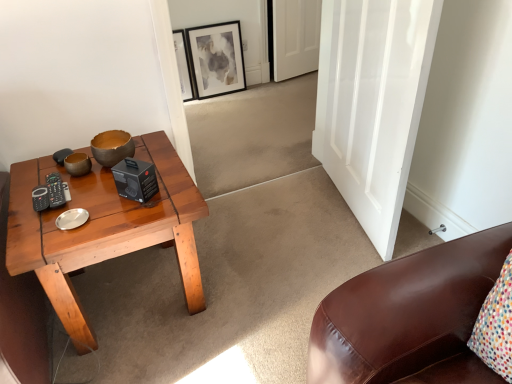
The height and width of the screenshot is (384, 512). Identify the location of vacant area situated below matte brown bowl at center (from a real-world perspective). (114, 160).